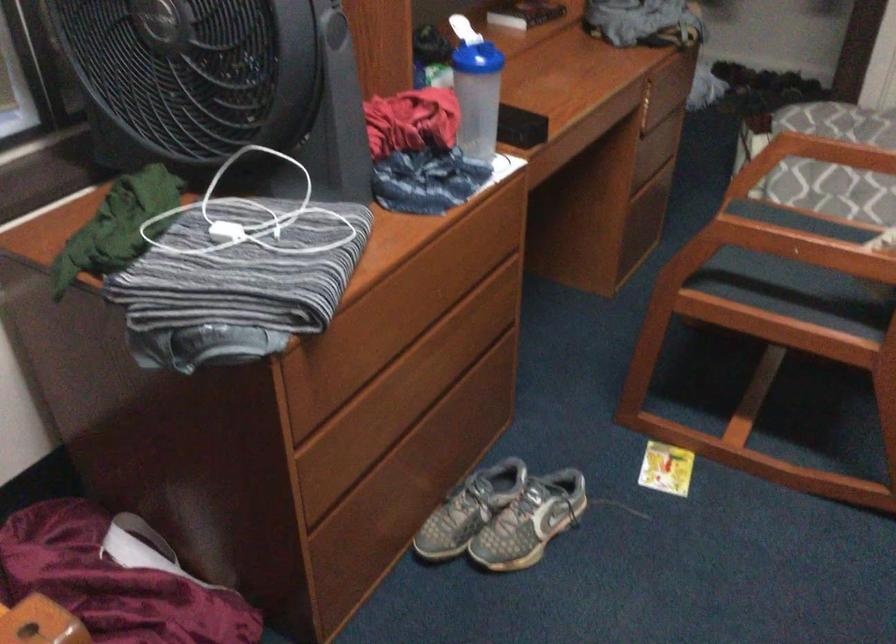
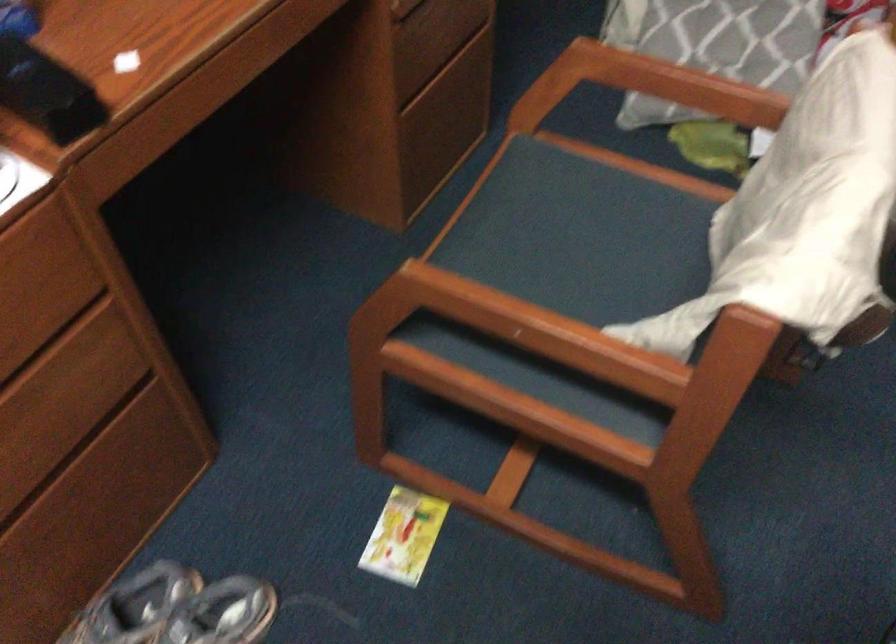
Question: The images are taken continuously from a first-person perspective. In which direction is your viewpoint rotating?

Choices:
 (A) Left
 (B) Right
 (C) Up
 (D) Down

Answer: (D)